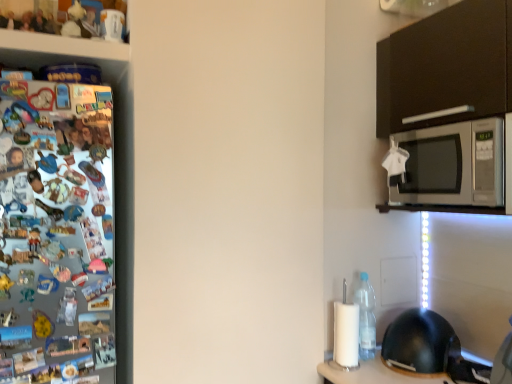
Question: Does point (416, 314) appear closer or farther from the camera than point (472, 203)?

Choices:
 (A) farther
 (B) closer

Answer: (A)

Question: In terms of width, does black matte helmet at lower right look wider or thinner when compared to silver metallic microwave at upper right?

Choices:
 (A) wide
 (B) thin

Answer: (B)

Question: Which object is the closest to the clear plastic bottle at lower right?

Choices:
 (A) black matte helmet at lower right
 (B) silver metallic microwave at upper right

Answer: (A)

Question: Which is farther from the silver metallic microwave at upper right?

Choices:
 (A) clear plastic bottle at lower right
 (B) black matte helmet at lower right

Answer: (B)